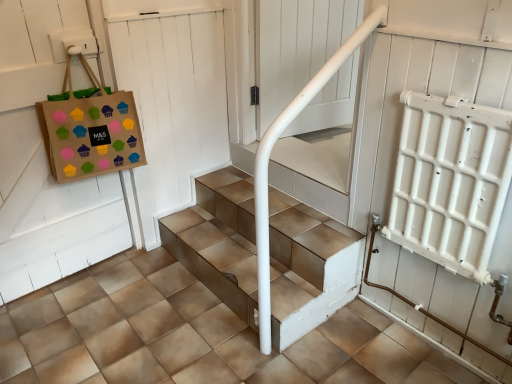
Question: Does metallic tile stairs at center turn towards white wooden door at upper left?

Choices:
 (A) no
 (B) yes

Answer: (A)

Question: Is metallic tile stairs at center facing away from white wooden door at upper left?

Choices:
 (A) yes
 (B) no

Answer: (B)

Question: From a real-world perspective, is metallic tile stairs at center under white wooden door at upper left?

Choices:
 (A) yes
 (B) no

Answer: (A)

Question: Is metallic tile stairs at center taller than white wooden door at upper left?

Choices:
 (A) yes
 (B) no

Answer: (B)

Question: Is metallic tile stairs at center further to camera compared to white wooden door at upper left?

Choices:
 (A) yes
 (B) no

Answer: (B)

Question: Does metallic tile stairs at center have a greater width compared to white wooden door at upper left?

Choices:
 (A) no
 (B) yes

Answer: (B)

Question: Is brown paper bag with colorful cupcake stickers at upper left positioned with its back to metallic tile stairs at center?

Choices:
 (A) no
 (B) yes

Answer: (A)

Question: From a real-world perspective, does brown paper bag with colorful cupcake stickers at upper left sit lower than metallic tile stairs at center?

Choices:
 (A) no
 (B) yes

Answer: (A)

Question: Are brown paper bag with colorful cupcake stickers at upper left and metallic tile stairs at center located far from each other?

Choices:
 (A) yes
 (B) no

Answer: (B)

Question: Is brown paper bag with colorful cupcake stickers at upper left bigger than metallic tile stairs at center?

Choices:
 (A) no
 (B) yes

Answer: (A)

Question: Is the position of brown paper bag with colorful cupcake stickers at upper left more distant than that of metallic tile stairs at center?

Choices:
 (A) no
 (B) yes

Answer: (A)

Question: Does brown paper bag with colorful cupcake stickers at upper left have a lesser height compared to metallic tile stairs at center?

Choices:
 (A) no
 (B) yes

Answer: (A)

Question: Is brown paper bag with colorful cupcake stickers at upper left far from white wooden door at upper left?

Choices:
 (A) no
 (B) yes

Answer: (A)